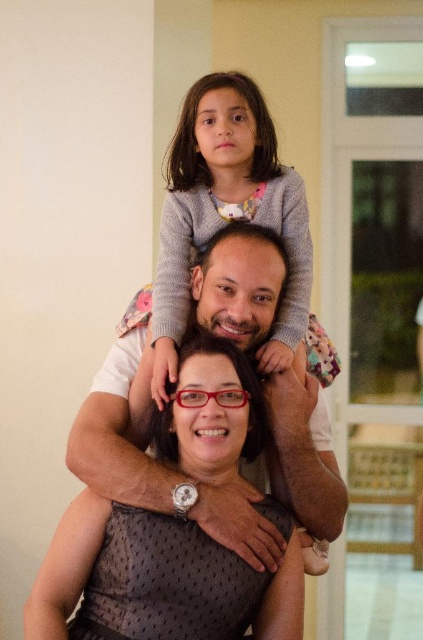
You are a photographer setting up a photoshoot. You need to ensure that the matte black dress at center and the matte white shirt at center are visible in the frame. Which one should you adjust your camera focus to prioritize if the dress is smaller?

The matte black dress at center is smaller than the matte white shirt at center. Therefore, you should prioritize focusing on the matte black dress at center to ensure its details are clear, as smaller objects may require closer attention to maintain sharpness.

Consider the image. You are standing in the living room and want to place a small decorative item on one of two spots marked by the points. The first spot is at point (x=126, y=342) and the second is at point (x=277, y=163). Which point is closer to you?

Point (x=126, y=342) is closer to the viewer than point (x=277, y=163), so you should place the decorative item there.

You are a photographer setting up for a family portrait. You have two key items to focus on in the scene described. The first is the matte black dress at center and the second is the gray sweater at upper center. Given that your camera has a depth of field that can sharply focus on objects within 16 inches, will both items be in focus simultaneously?

The matte black dress at center is 16.77 inches from the gray sweater at upper center. Since the distance between them is slightly over 16 inches, they cannot both be in focus at the same time with the current depth of field setting.